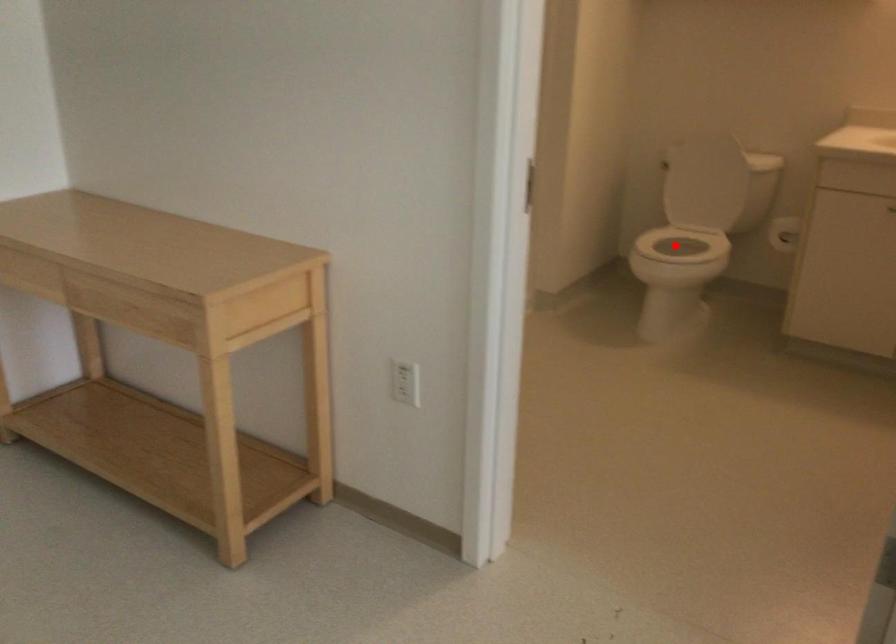
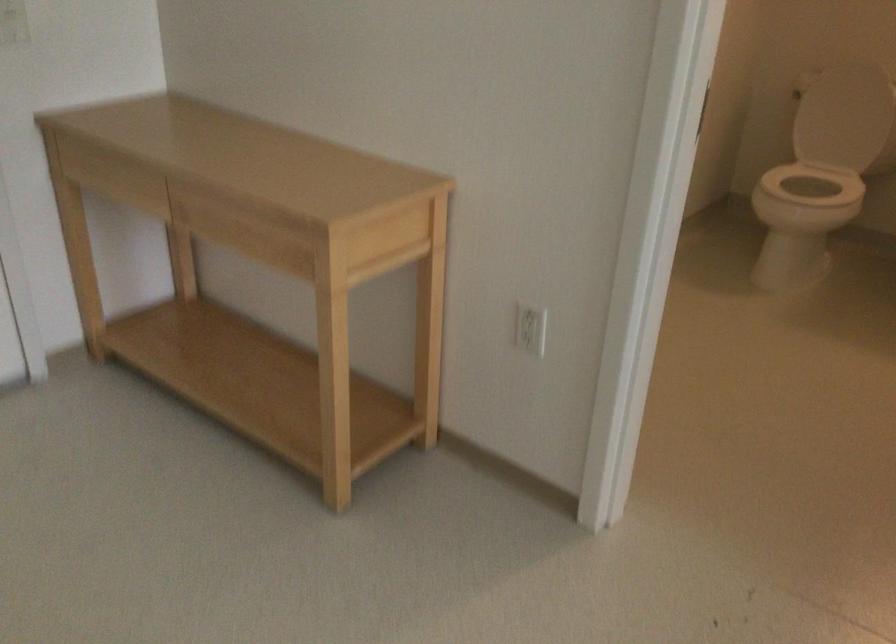
Find the pixel in the second image that matches the highlighted location in the first image.

(814, 184)